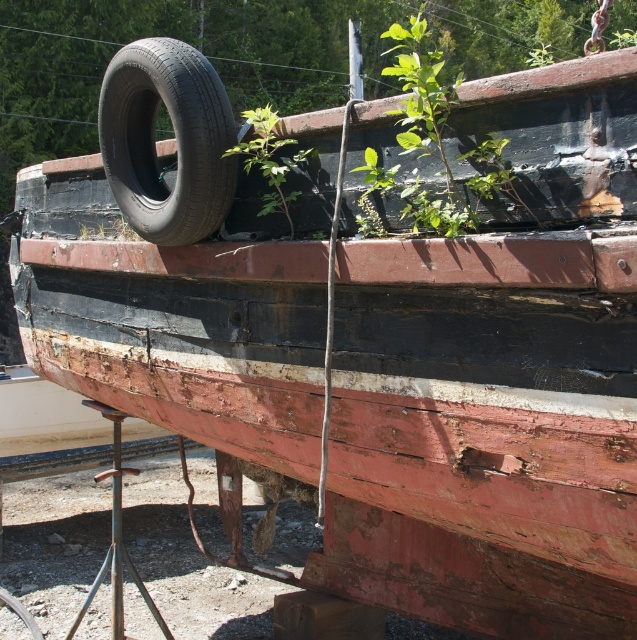
Is point (420, 90) in front of point (264, 157)?

Yes.

Who is more forward, (x=397, y=64) or (x=304, y=157)?

Point (x=304, y=157) is in front.

At what (x,y) coordinates should I click in order to perform the action: click on green leafy plant at upper center. Please return your answer as a coordinate pair (x, y). Image resolution: width=637 pixels, height=640 pixels. Looking at the image, I should click on point(440,140).

Which is more to the left, black rubber tire at upper left or green leafy plant at center?

green leafy plant at center

Who is taller, black rubber tire at upper left or green leafy plant at center?

Standing taller between the two is green leafy plant at center.

Is point (175, 106) in front of point (290, 225)?

Yes, point (175, 106) is closer to viewer.

You are a GUI agent. You are given a task and a screenshot of the screen. Output one action in this format:
    pyautogui.click(x=<x>, y=<y>)
    Task: Click on the black rubber tire at upper left
    
    Given the screenshot: What is the action you would take?
    pyautogui.click(x=175, y=140)

Does black rubber tire at upper left appear over green leafy plant at upper center?

Actually, black rubber tire at upper left is below green leafy plant at upper center.

Find the location of a particular element. This screenshot has height=640, width=637. black rubber tire at upper left is located at coordinates (175, 140).